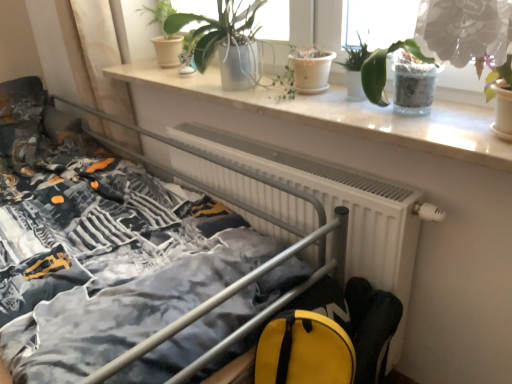
At what (x,y) coordinates should I click in order to perform the action: click on free space between translucent glass pot at upper right, arranged as the second houseplant when viewed from the right, and green glossy plant at upper right, which appears as the first houseplant when viewed from the right. Please return your answer as a coordinate pair (x, y). Looking at the image, I should click on (457, 114).